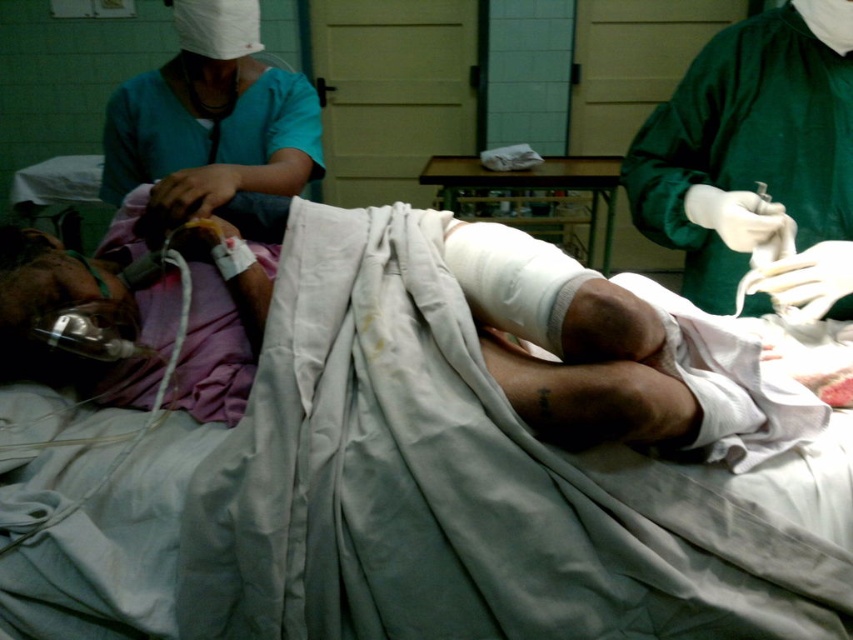
Can you confirm if white bandaged leg at center is positioned to the right of teal fabric uniform at upper left?

Correct, you'll find white bandaged leg at center to the right of teal fabric uniform at upper left.

Between white bandaged leg at center and teal fabric uniform at upper left, which one appears on the left side from the viewer's perspective?

teal fabric uniform at upper left

Is point (508, 364) farther from camera compared to point (260, 177)?

No, (508, 364) is closer to viewer.

At what (x,y) coordinates should I click in order to perform the action: click on white bandaged leg at center. Please return your answer as a coordinate pair (x, y). This screenshot has height=640, width=853. Looking at the image, I should click on (621, 356).

Does green smooth surgical gown at right have a larger size compared to teal fabric uniform at upper left?

No.

Which of these two, green smooth surgical gown at right or teal fabric uniform at upper left, stands taller?

teal fabric uniform at upper left is taller.

Find the location of `green smooth surgical gown at right`. green smooth surgical gown at right is located at coordinates (755, 160).

You are a GUI agent. You are given a task and a screenshot of the screen. Output one action in this format:
    pyautogui.click(x=<x>, y=<y>)
    Task: Click on the green smooth surgical gown at right
    This screenshot has width=853, height=640.
    Given the screenshot: What is the action you would take?
    pyautogui.click(x=755, y=160)

Does white bandaged leg at center have a lesser height compared to green smooth surgical gown at right?

Yes, white bandaged leg at center is shorter than green smooth surgical gown at right.

Between white bandaged leg at center and green smooth surgical gown at right, which one is positioned higher?

green smooth surgical gown at right is above.

Image resolution: width=853 pixels, height=640 pixels. What are the coordinates of `white bandaged leg at center` in the screenshot? It's located at (621, 356).

Locate an element on the screen. Image resolution: width=853 pixels, height=640 pixels. white bandaged leg at center is located at coordinates (621, 356).